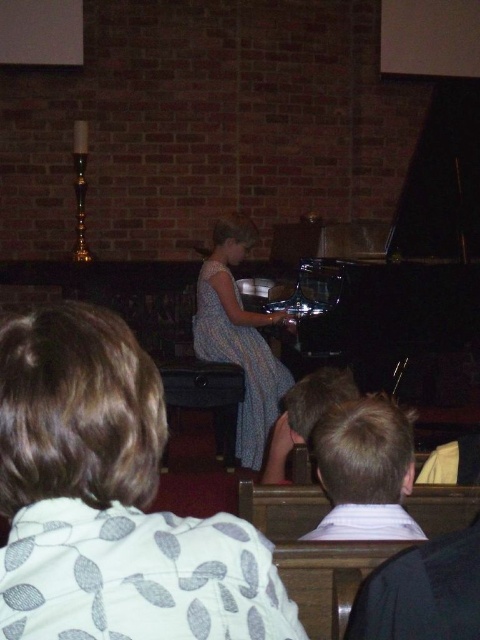
In the scene shown: You are sitting in the audience watching the performance. Which object, the matte gray dress at center or the black polished piano at center, is closer to the front of the stage?

The matte gray dress at center is closer to the front of the stage because it has a lesser height compared to the black polished piano at center, indicating it is positioned in front.

Based on the photo, you are an event organizer arranging seating for a performance. You need to seat two guests wearing the matte gray dress at center and the blue dotted fabric dress at center. Which guest should you seat in a seat with a narrower width to ensure comfort?

The matte gray dress at center is thinner than the blue dotted fabric dress at center, so the guest wearing the matte gray dress at center would require a narrower seat width compared to the guest in the blue dotted fabric dress at center.

You are an event planner arranging seats for a small recital. The black polished piano at center and the blue dotted fabric dress at center are both in the center. Which object takes up more horizontal space?

The black polished piano at center has a greater width than the blue dotted fabric dress at center, so it occupies more horizontal space.